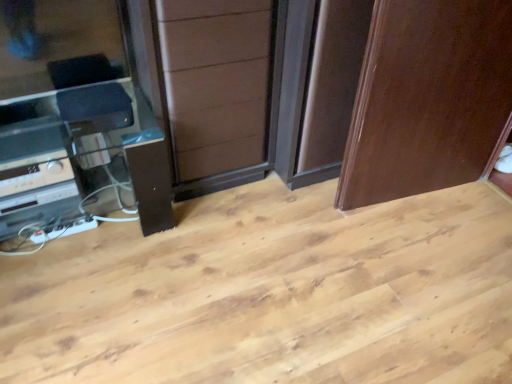
This screenshot has width=512, height=384. What do you see at coordinates (76, 122) in the screenshot?
I see `satin black entertainment center at left` at bounding box center [76, 122].

What do you see at coordinates (221, 89) in the screenshot? This screenshot has width=512, height=384. I see `brown wood screen door at center` at bounding box center [221, 89].

Where is `brown wood screen door at center`? This screenshot has width=512, height=384. brown wood screen door at center is located at coordinates (221, 89).

At what (x,y) coordinates should I click in order to perform the action: click on satin black entertainment center at left. Please return your answer as a coordinate pair (x, y). This screenshot has width=512, height=384. Looking at the image, I should click on (76, 122).

Is brown wood screen door at center at the right side of satin black stereo at lower left?

Yes.

Is brown wood screen door at center next to satin black stereo at lower left?

No, brown wood screen door at center is not making contact with satin black stereo at lower left.

In terms of width, does brown wood screen door at center look wider or thinner when compared to satin black stereo at lower left?

brown wood screen door at center is wider than satin black stereo at lower left.

Is brown wood screen door at center turned away from satin black stereo at lower left?

brown wood screen door at center is not turned away from satin black stereo at lower left.

Which object is more forward, brown wood screen door at center or satin black entertainment center at left?

Positioned in front is satin black entertainment center at left.

Does brown wood screen door at center have a greater width compared to satin black entertainment center at left?

Incorrect, the width of brown wood screen door at center does not surpass that of satin black entertainment center at left.

Consider the image. Which object is positioned more to the left, brown wood screen door at center or satin black entertainment center at left?

satin black entertainment center at left is more to the left.

This screenshot has width=512, height=384. I want to click on screen door below the glossy wood door at upper right (from a real-world perspective), so click(x=221, y=89).

From the image's perspective, which is below, glossy wood door at upper right or brown wood screen door at center?

glossy wood door at upper right.

Which object is further away from the camera taking this photo, glossy wood door at upper right or brown wood screen door at center?

brown wood screen door at center is further away from the camera.

Which object is positioned more to the right, glossy wood door at upper right or brown wood screen door at center?

Positioned to the right is glossy wood door at upper right.

Which of these two, brown wood screen door at center or glossy wood door at upper right, stands taller?

Standing taller between the two is glossy wood door at upper right.

Looking at this image, does brown wood screen door at center have a lesser width compared to glossy wood door at upper right?

In fact, brown wood screen door at center might be wider than glossy wood door at upper right.

From a real-world perspective, is brown wood screen door at center above or below glossy wood door at upper right?

Clearly, from a real-world perspective, brown wood screen door at center is below glossy wood door at upper right.

Is satin black entertainment center at left located outside brown wood screen door at center?

Yes, satin black entertainment center at left is located beyond the bounds of brown wood screen door at center.

Considering the sizes of satin black entertainment center at left and brown wood screen door at center in the image, is satin black entertainment center at left taller or shorter than brown wood screen door at center?

Clearly, satin black entertainment center at left is shorter compared to brown wood screen door at center.

Considering the positions of objects satin black entertainment center at left and brown wood screen door at center in the image provided, who is more to the right, satin black entertainment center at left or brown wood screen door at center?

brown wood screen door at center.

Considering the sizes of objects satin black entertainment center at left and brown wood screen door at center in the image provided, who is bigger, satin black entertainment center at left or brown wood screen door at center?

satin black entertainment center at left.

From the picture: Is glossy wood door at upper right directly adjacent to satin black stereo at lower left?

glossy wood door at upper right is not next to satin black stereo at lower left, and they're not touching.

Looking at this image, is glossy wood door at upper right spatially inside satin black stereo at lower left, or outside of it?

glossy wood door at upper right cannot be found inside satin black stereo at lower left.

Based on the photo, is glossy wood door at upper right aimed at satin black stereo at lower left?

No, glossy wood door at upper right is not turned towards satin black stereo at lower left.

Is glossy wood door at upper right far from satin black entertainment center at left?

Yes, glossy wood door at upper right and satin black entertainment center at left are quite far apart.

This screenshot has height=384, width=512. What are the coordinates of `door that is behind the satin black entertainment center at left` in the screenshot? It's located at (428, 99).

Which is more to the left, glossy wood door at upper right or satin black entertainment center at left?

satin black entertainment center at left is more to the left.

Is glossy wood door at upper right bigger or smaller than satin black entertainment center at left?

glossy wood door at upper right is smaller than satin black entertainment center at left.

Locate an element on the screen. The width and height of the screenshot is (512, 384). appliance below the brown wood screen door at center (from the image's perspective) is located at coordinates (34, 174).

You are a GUI agent. You are given a task and a screenshot of the screen. Output one action in this format:
    pyautogui.click(x=<x>, y=<y>)
    Task: Click on the screen door behind the satin black entertainment center at left
    This screenshot has width=512, height=384.
    Given the screenshot: What is the action you would take?
    pyautogui.click(x=221, y=89)

Which object lies nearer to the anchor point glossy wood door at upper right, satin black stereo at lower left or satin black entertainment center at left?

satin black entertainment center at left lies closer to glossy wood door at upper right than the other object.

Considering their positions, is satin black stereo at lower left positioned further to satin black entertainment center at left than brown wood screen door at center?

brown wood screen door at center lies further to satin black entertainment center at left than the other object.

From the image, which object appears to be farther from satin black stereo at lower left, brown wood screen door at center or satin black entertainment center at left?

brown wood screen door at center lies further to satin black stereo at lower left than the other object.

Estimate the real-world distances between objects in this image. Which object is closer to brown wood screen door at center, satin black entertainment center at left or glossy wood door at upper right?

The object closer to brown wood screen door at center is satin black entertainment center at left.

Which object lies further to the anchor point satin black stereo at lower left, satin black entertainment center at left or brown wood screen door at center?

brown wood screen door at center.

Which object lies further to the anchor point satin black entertainment center at left, brown wood screen door at center or glossy wood door at upper right?

The object further to satin black entertainment center at left is glossy wood door at upper right.

Based on their spatial positions, is satin black entertainment center at left or satin black stereo at lower left closer to brown wood screen door at center?

The object closer to brown wood screen door at center is satin black entertainment center at left.

When comparing their distances from satin black entertainment center at left, does satin black stereo at lower left or glossy wood door at upper right seem further?

glossy wood door at upper right is positioned further to the anchor satin black entertainment center at left.

In order to click on screen door between satin black entertainment center at left and glossy wood door at upper right in this screenshot , I will do `click(221, 89)`.

I want to click on entertainment center situated between satin black stereo at lower left and brown wood screen door at center from left to right, so click(76, 122).

The image size is (512, 384). Identify the location of screen door between satin black stereo at lower left and glossy wood door at upper right. point(221,89).

Where is `entertainment center situated between satin black stereo at lower left and glossy wood door at upper right from left to right`? Image resolution: width=512 pixels, height=384 pixels. entertainment center situated between satin black stereo at lower left and glossy wood door at upper right from left to right is located at coordinates (76, 122).